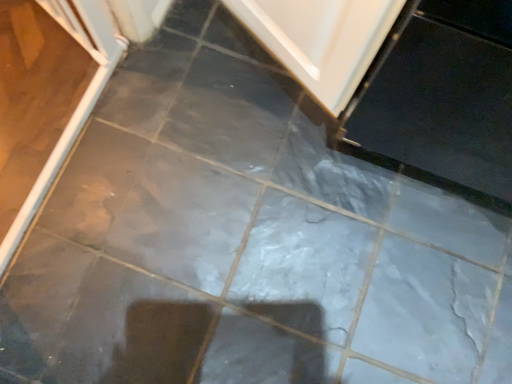
What do you see at coordinates (79, 102) in the screenshot?
I see `white glossy screen door at left` at bounding box center [79, 102].

At what (x,y) coordinates should I click in order to perform the action: click on white glossy screen door at left. Please return your answer as a coordinate pair (x, y). Looking at the image, I should click on (79, 102).

The width and height of the screenshot is (512, 384). In order to click on white glossy door at upper center in this screenshot , I will do `click(322, 40)`.

What do you see at coordinates (322, 40) in the screenshot? The image size is (512, 384). I see `white glossy door at upper center` at bounding box center [322, 40].

I want to click on white glossy screen door at left, so click(79, 102).

Considering the relative positions of white glossy screen door at left and white glossy door at upper center in the image provided, is white glossy screen door at left to the right of white glossy door at upper center from the viewer's perspective?

No.

Which is behind, white glossy screen door at left or white glossy door at upper center?

white glossy door at upper center.

Is point (88, 44) farther from viewer compared to point (357, 72)?

Yes, point (88, 44) is behind point (357, 72).

From the image's perspective, does white glossy screen door at left appear lower than white glossy door at upper center?

Yes.

From a real-world perspective, is white glossy screen door at left located higher than white glossy door at upper center?

Actually, white glossy screen door at left is physically below white glossy door at upper center in the real world.

Can you confirm if white glossy screen door at left is thinner than white glossy door at upper center?

Yes, white glossy screen door at left is thinner than white glossy door at upper center.

Considering the sizes of objects white glossy screen door at left and white glossy door at upper center in the image provided, who is shorter, white glossy screen door at left or white glossy door at upper center?

With less height is white glossy screen door at left.

Which of these two, white glossy screen door at left or white glossy door at upper center, is bigger?

white glossy door at upper center is bigger.

Looking at this image, is white glossy screen door at left not within white glossy door at upper center?

That's correct, white glossy screen door at left is outside of white glossy door at upper center.

Are white glossy screen door at left and white glossy door at upper center making contact?

No, white glossy screen door at left is not making contact with white glossy door at upper center.

Could you tell me if white glossy screen door at left is facing white glossy door at upper center?

No, white glossy screen door at left is not oriented towards white glossy door at upper center.

How many degrees apart are the facing directions of white glossy screen door at left and white glossy door at upper center?

The facing directions of white glossy screen door at left and white glossy door at upper center are 91.2 degrees apart.

Measure the distance between white glossy screen door at left and white glossy door at upper center.

The distance of white glossy screen door at left from white glossy door at upper center is 20.30 inches.

You are a GUI agent. You are given a task and a screenshot of the screen. Output one action in this format:
    pyautogui.click(x=<x>, y=<y>)
    Task: Click on the door above the white glossy screen door at left (from the image's perspective)
    
    Given the screenshot: What is the action you would take?
    pyautogui.click(x=322, y=40)

Would you say white glossy door at upper center is to the left or to the right of white glossy screen door at left in the picture?

From the image, it's evident that white glossy door at upper center is to the right of white glossy screen door at left.

Considering their positions, is white glossy door at upper center located in front of or behind white glossy screen door at left?

Clearly, white glossy door at upper center is behind white glossy screen door at left.

Does point (251, 26) lie behind point (95, 43)?

No.

From the image's perspective, which one is positioned higher, white glossy door at upper center or white glossy screen door at left?

white glossy door at upper center, from the image's perspective.

From a real-world perspective, between white glossy door at upper center and white glossy screen door at left, who is vertically lower?

In real-world perspective, white glossy screen door at left is lower.

Can you confirm if white glossy door at upper center is wider than white glossy screen door at left?

Correct, the width of white glossy door at upper center exceeds that of white glossy screen door at left.

Between white glossy door at upper center and white glossy screen door at left, which one has less height?

white glossy screen door at left.

Looking at this image, can you confirm if white glossy door at upper center is smaller than white glossy screen door at left?

Actually, white glossy door at upper center might be larger than white glossy screen door at left.

Can we say white glossy door at upper center lies outside white glossy screen door at left?

Yes, white glossy door at upper center is outside of white glossy screen door at left.

Is white glossy door at upper center beside white glossy screen door at left?

white glossy door at upper center and white glossy screen door at left are clearly separated.

Is white glossy door at upper center facing towards white glossy screen door at left?

Yes.

How many degrees apart are the facing directions of white glossy door at upper center and white glossy screen door at left?

They differ by 91.2 degrees in their facing directions.

How far apart are white glossy door at upper center and white glossy screen door at left?

white glossy door at upper center is 20.30 inches away from white glossy screen door at left.

Find the location of a particular element. Image resolution: width=512 pixels, height=384 pixels. door that is on the right side of white glossy screen door at left is located at coordinates (322, 40).

You are a GUI agent. You are given a task and a screenshot of the screen. Output one action in this format:
    pyautogui.click(x=<x>, y=<y>)
    Task: Click on the door lying above the white glossy screen door at left (from the image's perspective)
    This screenshot has height=384, width=512.
    Given the screenshot: What is the action you would take?
    pyautogui.click(x=322, y=40)

Where is `door behind the white glossy screen door at left`? Image resolution: width=512 pixels, height=384 pixels. door behind the white glossy screen door at left is located at coordinates (322, 40).